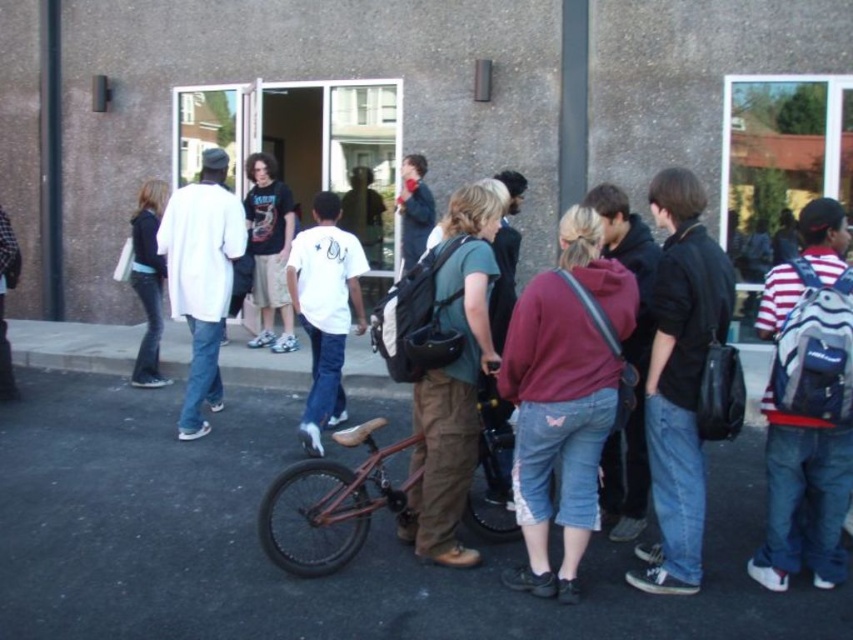
Question: Does green fabric backpack at center appear on the left side of white matte t-shirt at center?

Choices:
 (A) no
 (B) yes

Answer: (A)

Question: Based on their relative distances, which object is nearer to the green fabric backpack at center?

Choices:
 (A) maroon fleece hoodie at center
 (B) shiny brown bicycle at center
 (C) white matte t-shirt at center

Answer: (A)

Question: Which point appears farthest from the camera in this image?

Choices:
 (A) (543, 330)
 (B) (418, 440)

Answer: (B)

Question: Can you confirm if maroon fleece hoodie at center is positioned below white matte t-shirt at center?

Choices:
 (A) yes
 (B) no

Answer: (A)

Question: Which object is the closest to the shiny brown bicycle at center?

Choices:
 (A) white matte t-shirt at center
 (B) green fabric backpack at center
 (C) maroon fleece hoodie at center

Answer: (B)

Question: Is maroon fleece hoodie at center to the right of shiny brown bicycle at center from the viewer's perspective?

Choices:
 (A) no
 (B) yes

Answer: (B)